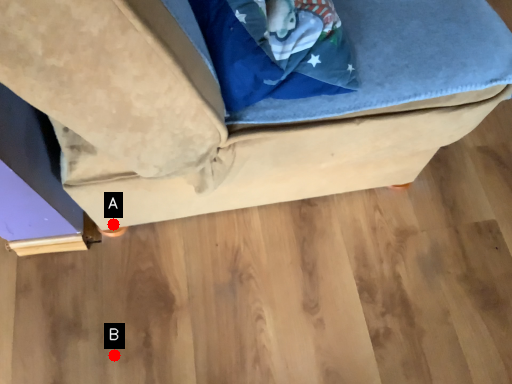
Question: Two points are circled on the image, labeled by A and B beside each circle. Which point is farther from the camera taking this photo?

Choices:
 (A) A is further
 (B) B is further

Answer: (A)